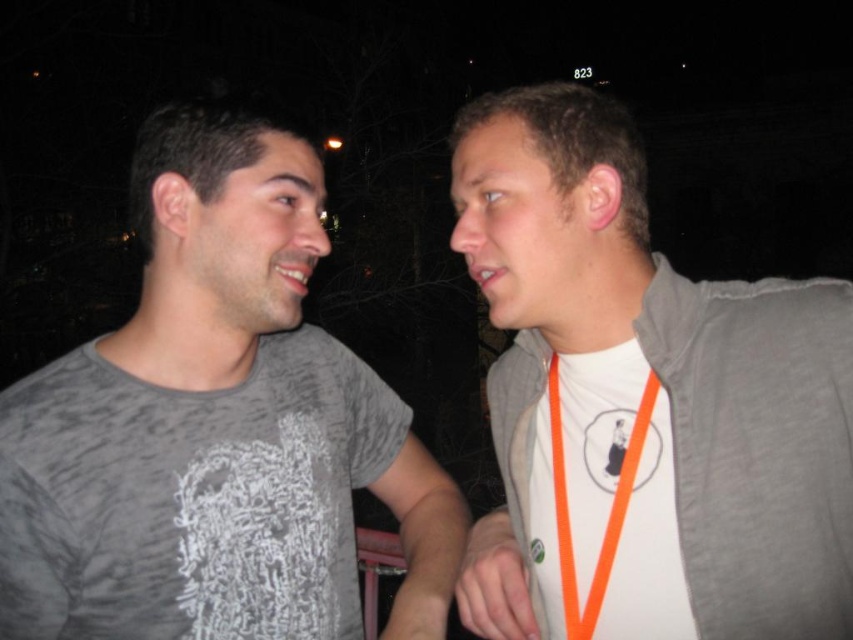
Question: Does white fabric shirt at right appear over gray matte t-shirt at left?

Choices:
 (A) yes
 (B) no

Answer: (A)

Question: Which object is closer to the camera taking this photo?

Choices:
 (A) orange fabric lanyard at center
 (B) gray matte t-shirt at left
 (C) skinsmoothneck at right
 (D) white fabric shirt at right

Answer: (D)

Question: Can you confirm if gray matte neck at center is wider than skinsmoothneck at right?

Choices:
 (A) yes
 (B) no

Answer: (A)

Question: Where is gray matte neck at center located in relation to skinsmoothneck at right in the image?

Choices:
 (A) right
 (B) left

Answer: (B)

Question: Which of the following is the farthest from the observer?

Choices:
 (A) white fabric shirt at right
 (B) skinsmoothneck at right
 (C) orange fabric lanyard at center

Answer: (B)

Question: Which is farther from the gray matte neck at center?

Choices:
 (A) skinsmoothneck at right
 (B) white fabric shirt at right
 (C) gray matte t-shirt at left

Answer: (B)